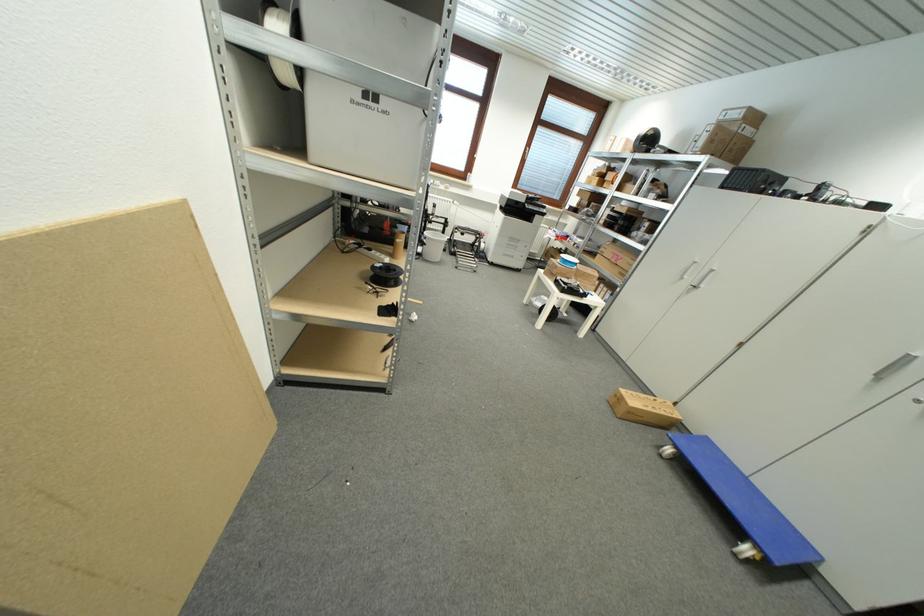
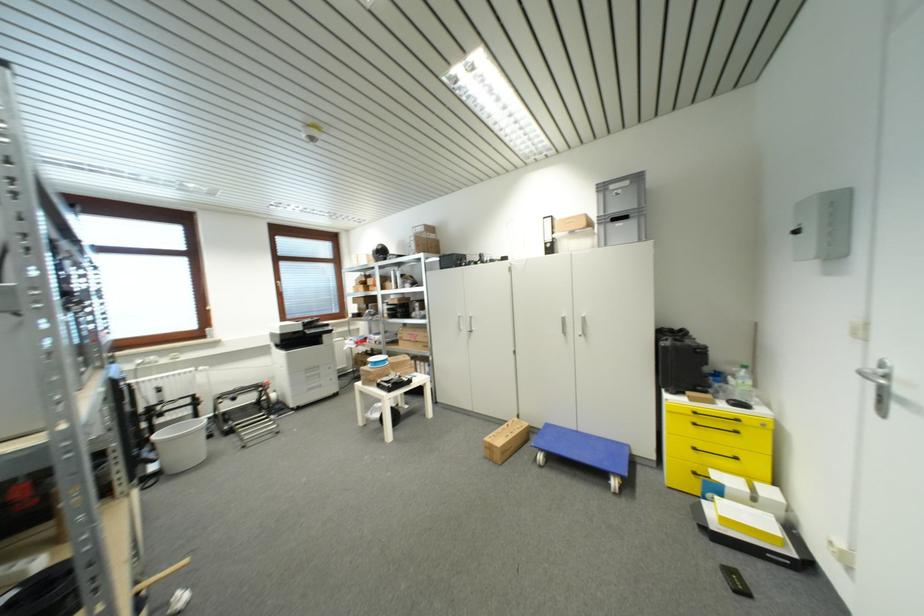
Find the pixel in the second image that matches (695,281) in the first image.

(468, 330)